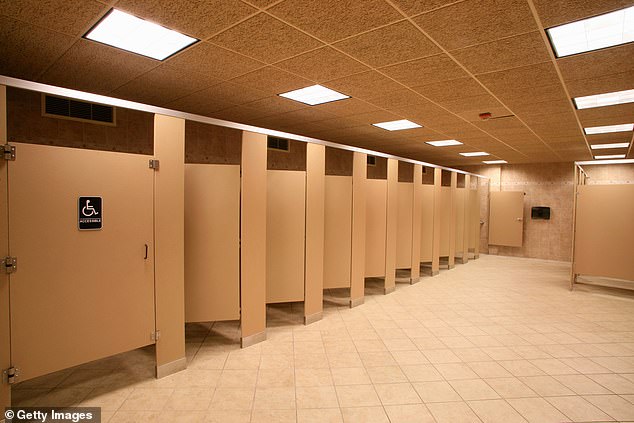
Identify the location of handicap stall. (119, 307).